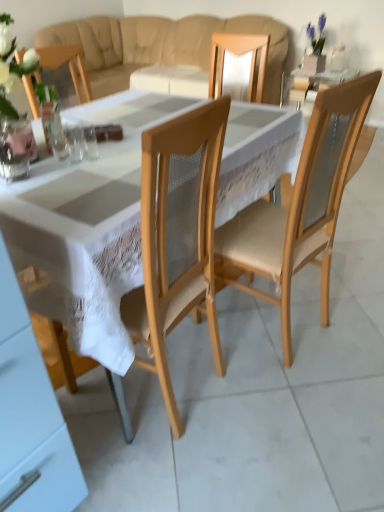
Find the location of a particular element. vacant space behind clear glass vase at lower left is located at coordinates (56, 158).